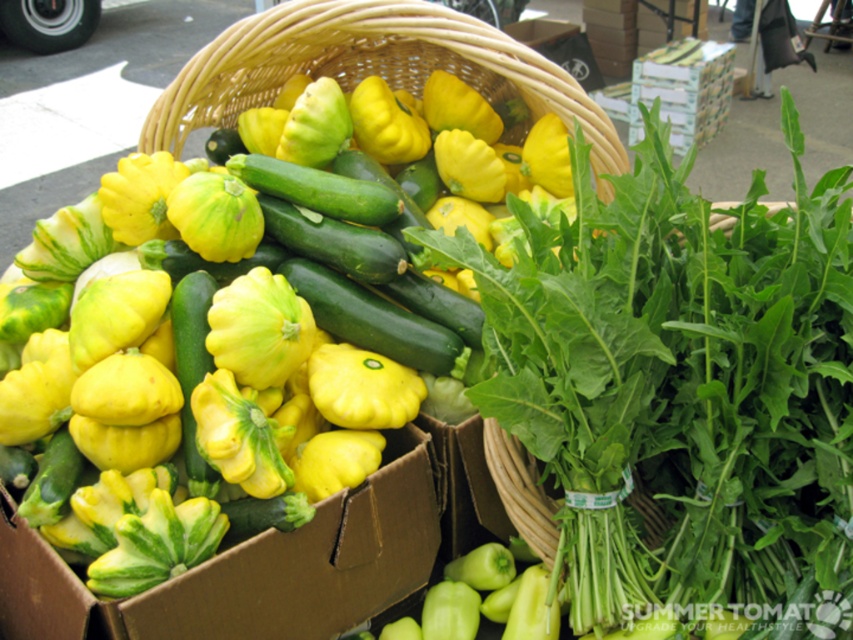
Question: Can you confirm if green smooth zucchini at center is positioned to the left of green matte cucumber at center?

Choices:
 (A) no
 (B) yes

Answer: (A)

Question: Can you confirm if green smooth zucchini at center is positioned to the right of green matte cucumber at center?

Choices:
 (A) yes
 (B) no

Answer: (A)

Question: Which object is farther from the camera taking this photo?

Choices:
 (A) green matte cucumber at center
 (B) green smooth zucchini at center

Answer: (B)

Question: Which object is farther from the camera taking this photo?

Choices:
 (A) green smooth zucchini at center
 (B) green matte cucumber at center

Answer: (A)

Question: Is green smooth zucchini at center wider than green matte cucumber at center?

Choices:
 (A) yes
 (B) no

Answer: (A)

Question: Among these points, which one is nearest to the camera?

Choices:
 (A) (190, 320)
 (B) (270, 179)

Answer: (A)